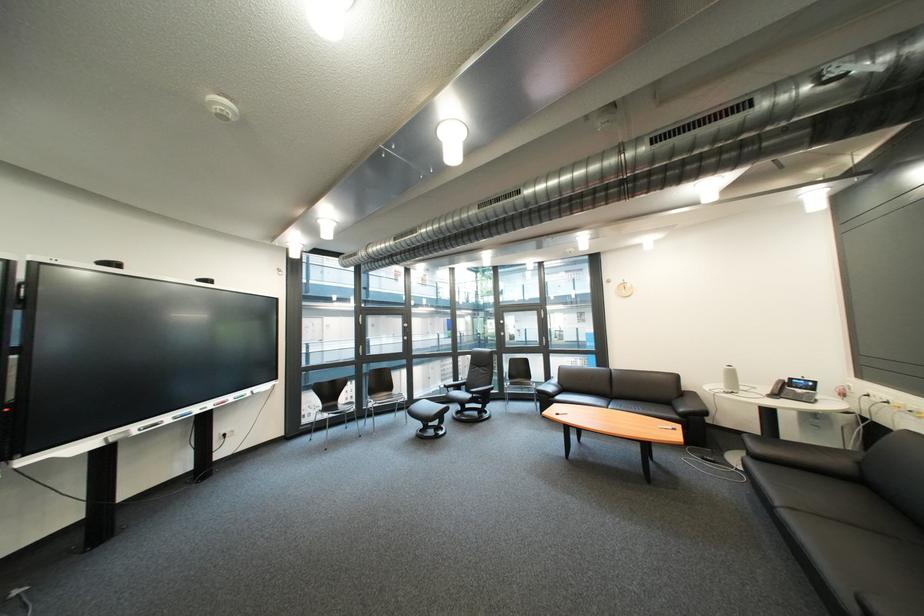
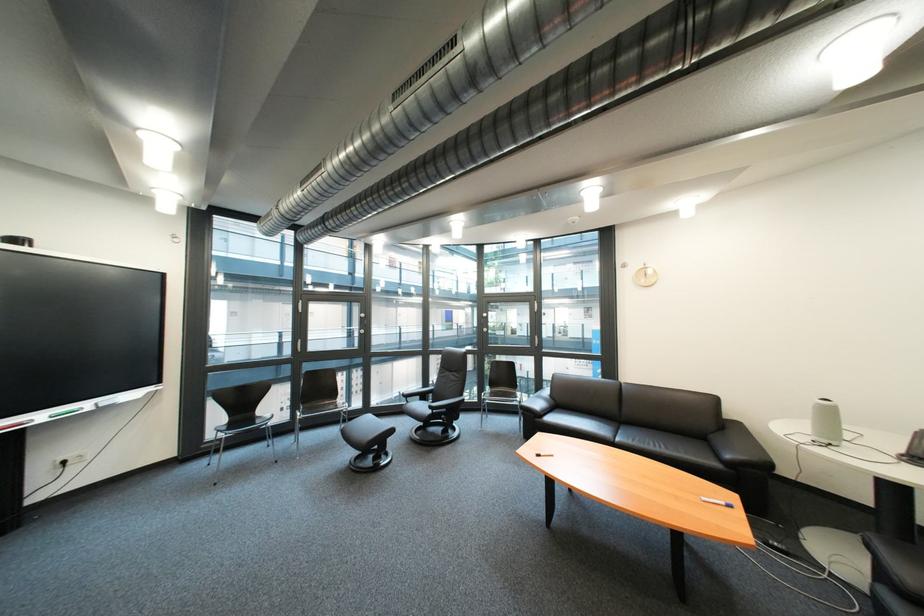
Find the pixel in the second image that matches point (412, 411) in the first image.

(359, 424)